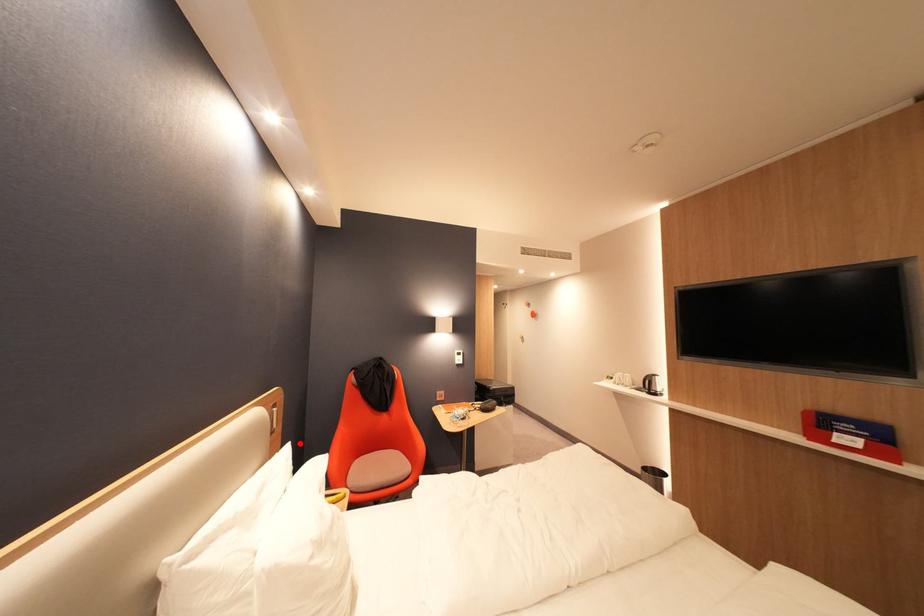
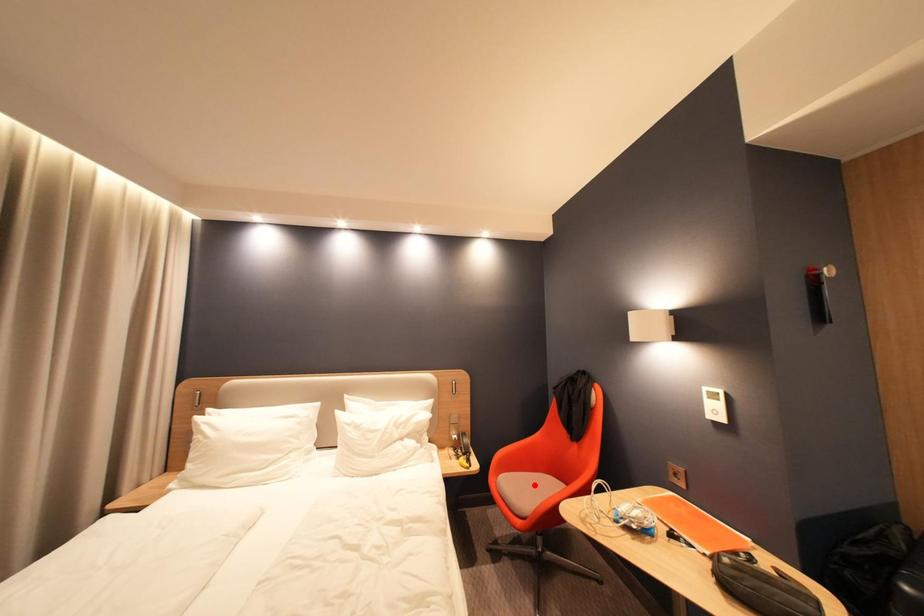
I am providing you with two images of the same scene from different viewpoints. A red point is marked on the first image and another point is marked on the second image. Do the highlighted points in image1 and image2 indicate the same real-world spot?

No